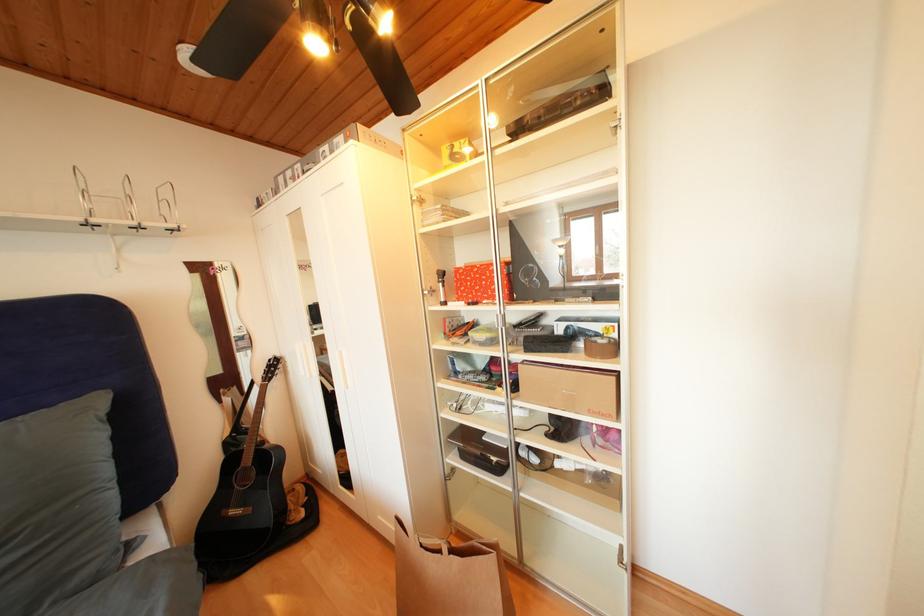
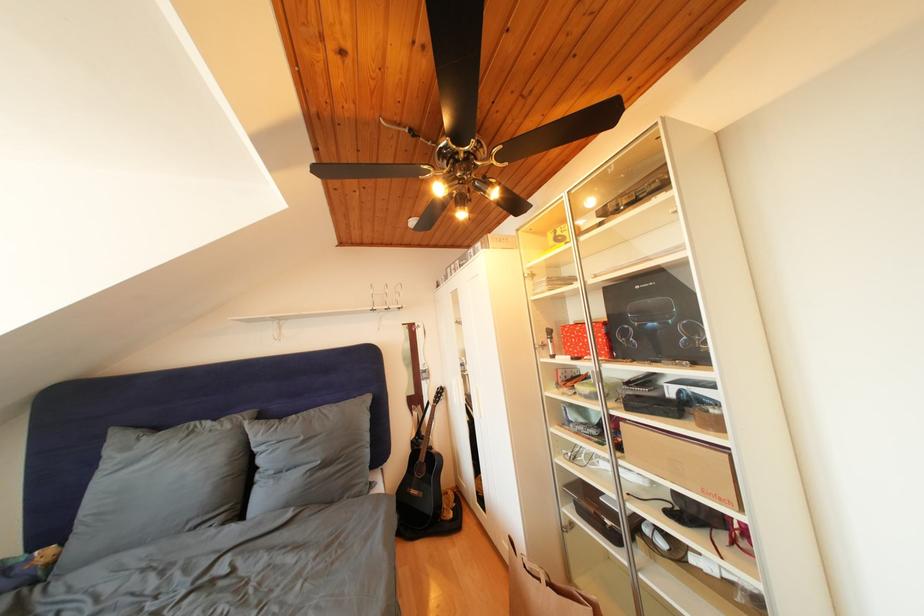
Locate, in the second image, the point that corresponds to pixel 458 557 in the first image.

(556, 590)